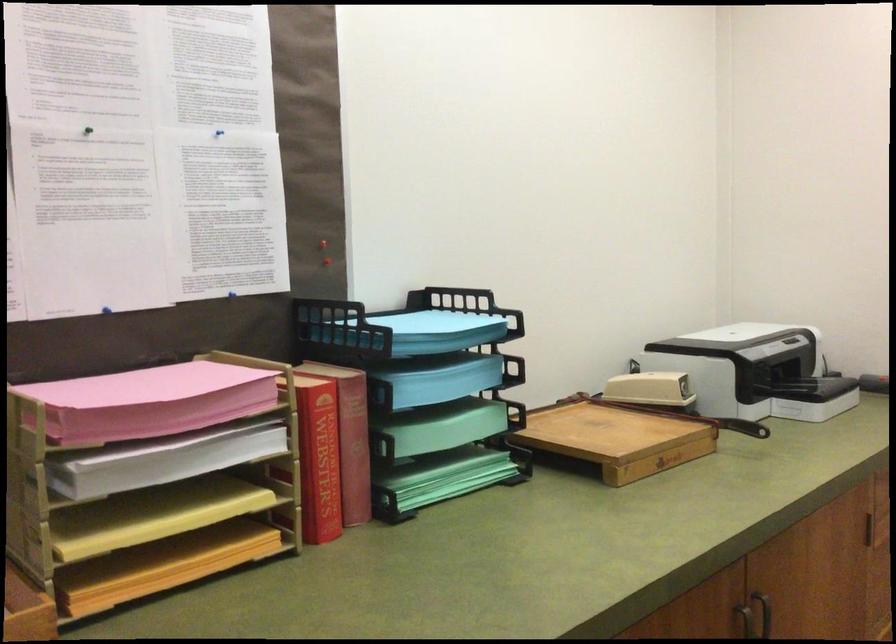
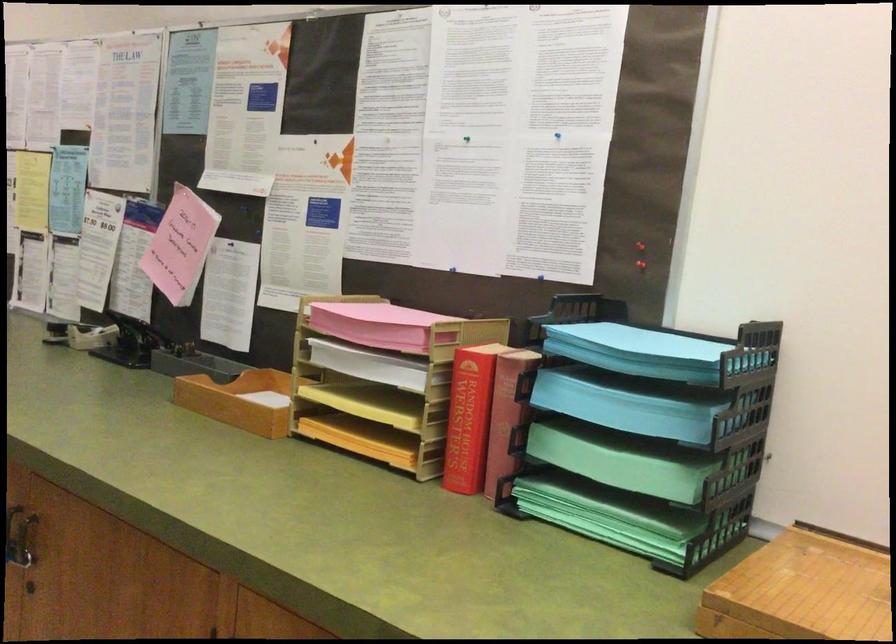
The point at (76, 133) is marked in the first image. Where is the corresponding point in the second image?

(467, 138)